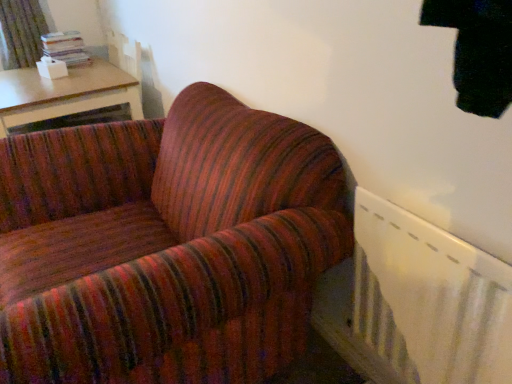
Question: In the image, is green textured curtain at upper left on the left side or the right side of wooden table at upper left?

Choices:
 (A) right
 (B) left

Answer: (B)

Question: Which is correct: green textured curtain at upper left is inside wooden table at upper left, or outside of it?

Choices:
 (A) outside
 (B) inside

Answer: (A)

Question: Which object is the closest to the green textured curtain at upper left?

Choices:
 (A) white plastic radiator at lower right
 (B) wooden table at upper left

Answer: (B)

Question: Estimate the real-world distances between objects in this image. Which object is closer to the wooden table at upper left?

Choices:
 (A) white plastic radiator at lower right
 (B) green textured curtain at upper left

Answer: (B)